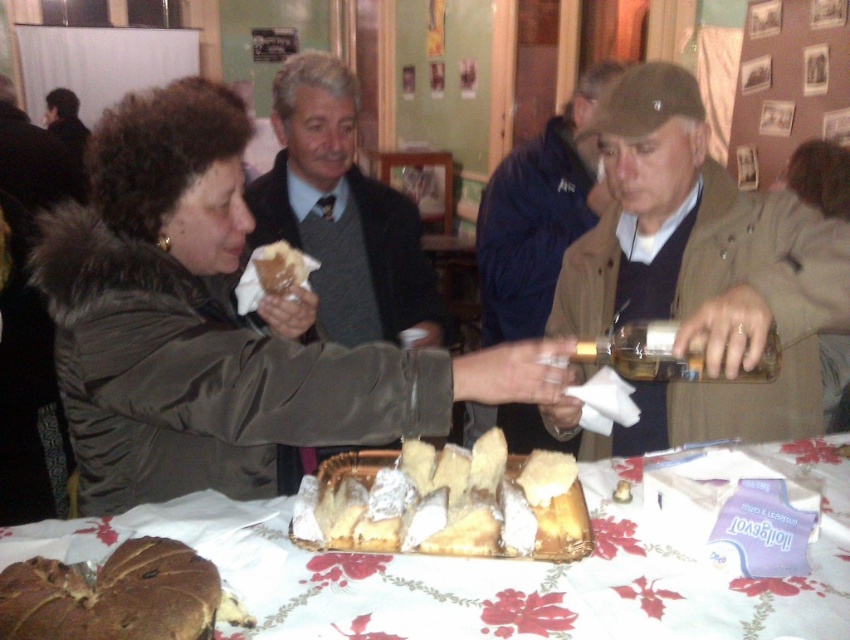
Does point (375, 250) come farther from viewer compared to point (584, 204)?

No, (375, 250) is in front of (584, 204).

Can you confirm if dark gray sweater at center is positioned below brown leather jacket at upper center?

Indeed, dark gray sweater at center is positioned under brown leather jacket at upper center.

The width and height of the screenshot is (850, 640). Identify the location of dark gray sweater at center. (340, 218).

You are a GUI agent. You are given a task and a screenshot of the screen. Output one action in this format:
    pyautogui.click(x=<x>, y=<y>)
    Task: Click on the dark gray sweater at center
    
    Given the screenshot: What is the action you would take?
    pyautogui.click(x=340, y=218)

Which of these two, brown leather jacket at upper center or brown crumbly pastry at lower left, stands shorter?

With less height is brown crumbly pastry at lower left.

How far apart are brown leather jacket at upper center and brown crumbly pastry at lower left?

brown leather jacket at upper center and brown crumbly pastry at lower left are 1.62 meters apart from each other.

Who is more forward, (573, 202) or (26, 609)?

Point (26, 609)

Where is `brown leather jacket at upper center`? The height and width of the screenshot is (640, 850). brown leather jacket at upper center is located at coordinates (537, 216).

Can you confirm if brown leather jacket at upper center is positioned to the left of translucent glass bottle at center?

Indeed, brown leather jacket at upper center is positioned on the left side of translucent glass bottle at center.

Who is shorter, brown leather jacket at upper center or translucent glass bottle at center?

With less height is translucent glass bottle at center.

Is point (536, 436) closer to viewer compared to point (663, 369)?

No, (536, 436) is further to viewer.

Identify the location of brown leather jacket at upper center. (537, 216).